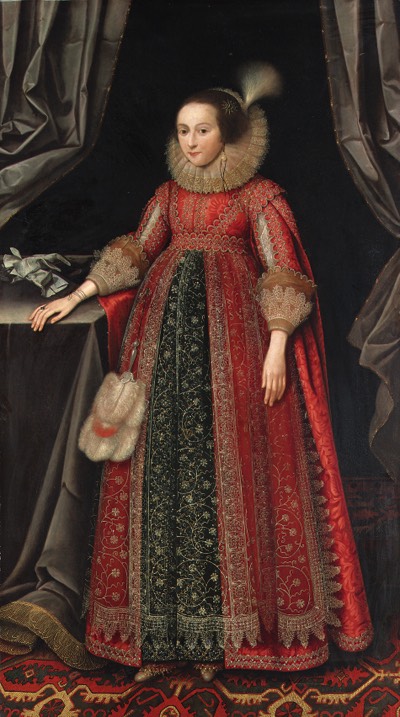
Point out all instances of what appears to be shoes in the image. Your answer should be formatted as a list of tuples, i.e. [(x1, y1), (x2, y2), ...], where each tuple contains the x and y coordinates of a point satisfying the conditions above.

[(152, 672), (205, 670)]